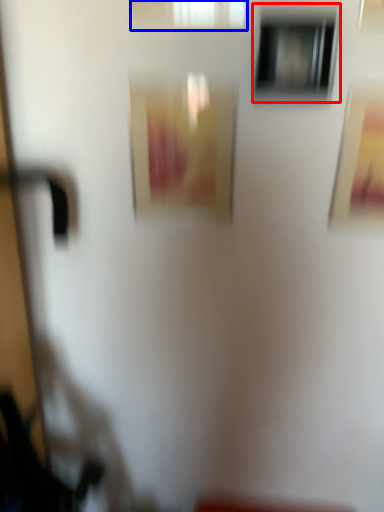
Question: Which point is closer to the camera, window (highlighted by a red box) or window (highlighted by a blue box)?

Choices:
 (A) window
 (B) window

Answer: (B)